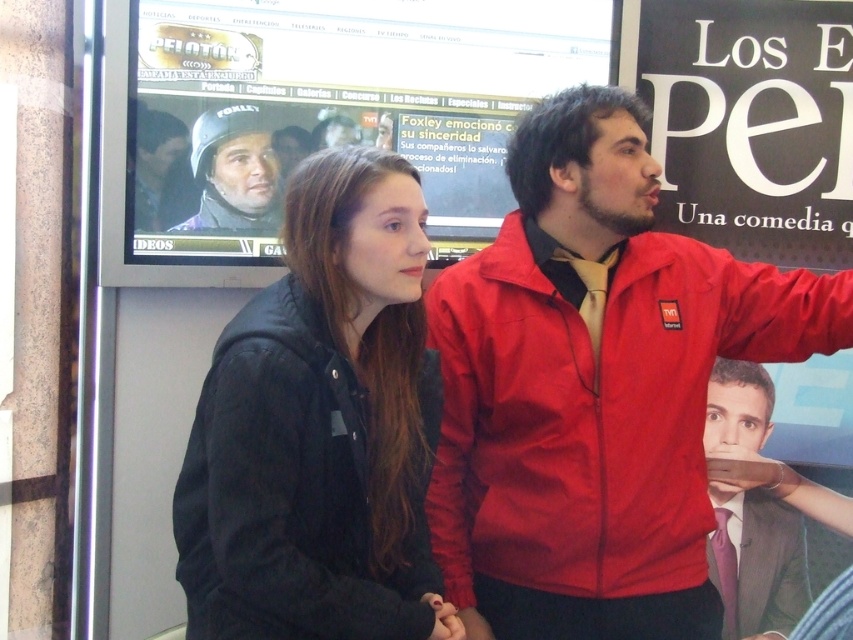
Looking at this image, you are a photographer trying to capture a closeup of the matte black helmet at upper center without including the matte red jacket at center in the frame. Is this possible given their positions?

The matte red jacket at center is closer to the viewer than the matte black helmet at upper center, so it would block the view of the helmet. Therefore, it is not possible to capture a closeup of the matte black helmet at upper center without including the matte red jacket at center in the frame.

You are a fashion designer analyzing the image. You need to determine which item is wider between the smooth suit at center and the matte black helmet at upper left. Which one is wider?

The smooth suit at center is wider than the matte black helmet at upper left according to the description.